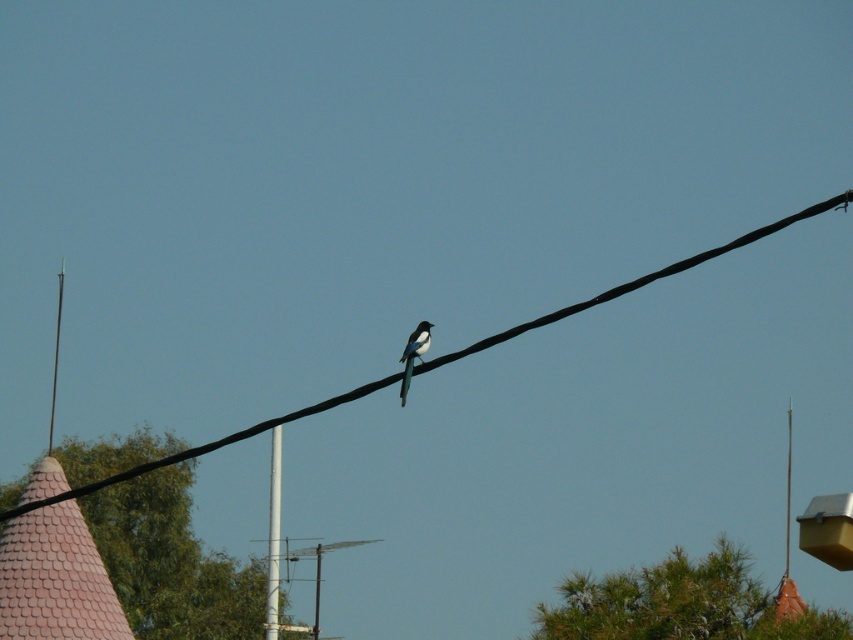
Which of these two, black wire at center or white glossy bird at center, stands taller?

black wire at center

Is point (802, 212) positioned before point (416, 333)?

Yes, point (802, 212) is closer to viewer.

Is point (360, 394) positioned in front of point (403, 352)?

Yes, it is.

This screenshot has width=853, height=640. I want to click on black wire at center, so click(635, 282).

Can you confirm if white plastic telegraph pole at center is positioned below smooth white pole at left?

Correct, white plastic telegraph pole at center is located below smooth white pole at left.

Is white plastic telegraph pole at center in front of smooth white pole at left?

Yes, it is in front of smooth white pole at left.

Is point (276, 547) positioned after point (50, 436)?

No, it is in front of (50, 436).

The width and height of the screenshot is (853, 640). Identify the location of white plastic telegraph pole at center. (273, 536).

Based on the photo, which is below, black wire at center or smooth white pole at left?

Positioned lower is smooth white pole at left.

What do you see at coordinates (635, 282) in the screenshot? The width and height of the screenshot is (853, 640). I see `black wire at center` at bounding box center [635, 282].

Locate an element on the screen. black wire at center is located at coordinates (635, 282).